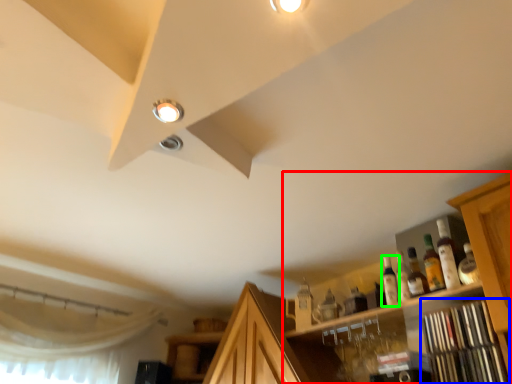
Question: Considering the real-world distances, which object is farthest from cabinetry (highlighted by a red box)? shelf (highlighted by a blue box) or bottle (highlighted by a green box)?

Choices:
 (A) shelf
 (B) bottle

Answer: (B)